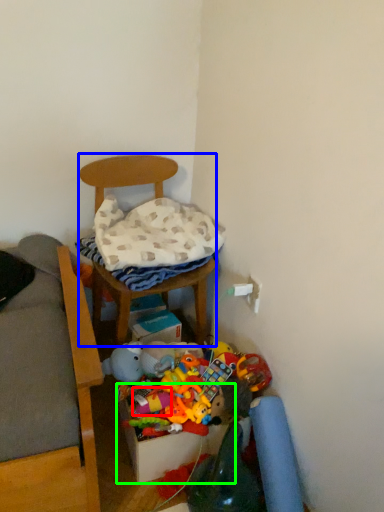
Question: Which is farther away from toy (highlighted by a red box)? furniture (highlighted by a blue box) or storage box (highlighted by a green box)?

Choices:
 (A) furniture
 (B) storage box

Answer: (A)